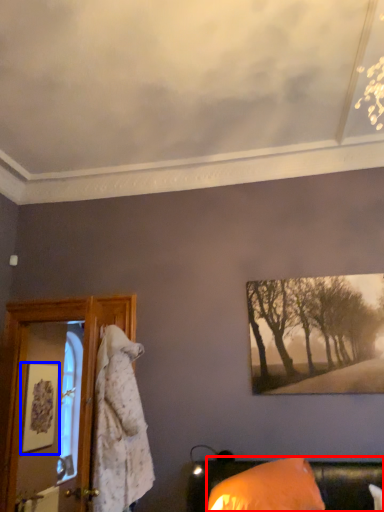
Question: Which point is closer to the camera, furniture (highlighted by a red box) or picture frame (highlighted by a blue box)?

Choices:
 (A) furniture
 (B) picture frame

Answer: (A)